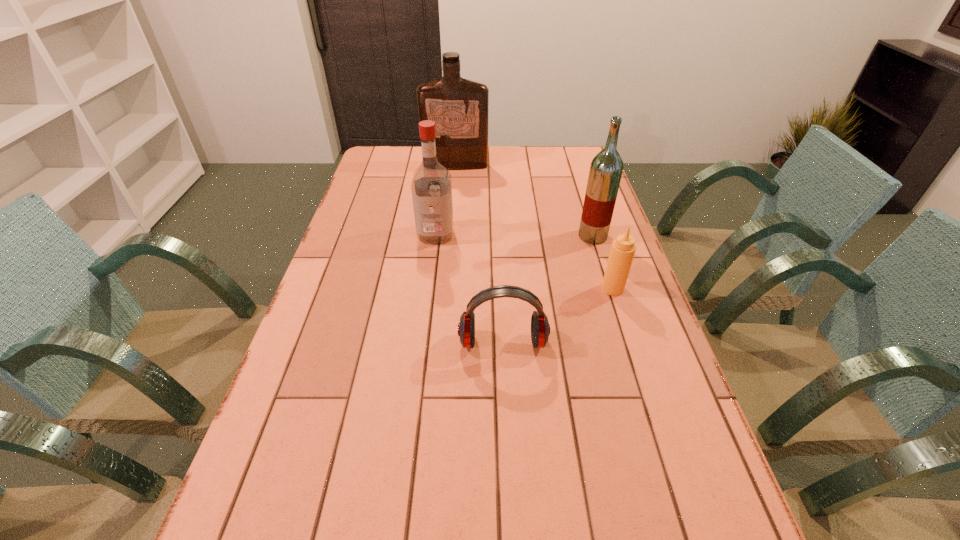
I want to click on the farthest liquor, so click(x=459, y=107).

You are a GUI agent. You are given a task and a screenshot of the screen. Output one action in this format:
    pyautogui.click(x=<x>, y=<y>)
    Task: Click on the rightmost liquor
    The width and height of the screenshot is (960, 540).
    Given the screenshot: What is the action you would take?
    pyautogui.click(x=606, y=168)

Locate an element on the screen. the second nearest object is located at coordinates (622, 251).

Locate an element on the screen. The image size is (960, 540). the second shortest object is located at coordinates (622, 251).

Locate an element on the screen. The height and width of the screenshot is (540, 960). the shortest object is located at coordinates (540, 328).

The width and height of the screenshot is (960, 540). Find the location of `earphone`. earphone is located at coordinates (540, 328).

Where is `vacant region located 0.270m on the label side of the farthest liquor`? This screenshot has width=960, height=540. vacant region located 0.270m on the label side of the farthest liquor is located at coordinates (452, 210).

Locate an element on the screen. blank area located on the left of the rightmost liquor is located at coordinates (457, 236).

This screenshot has height=540, width=960. Identify the location of vacant space located on the front of the condiment. (621, 315).

Identify the location of vacant space located 0.310m on the ear cups of the earphone. (511, 492).